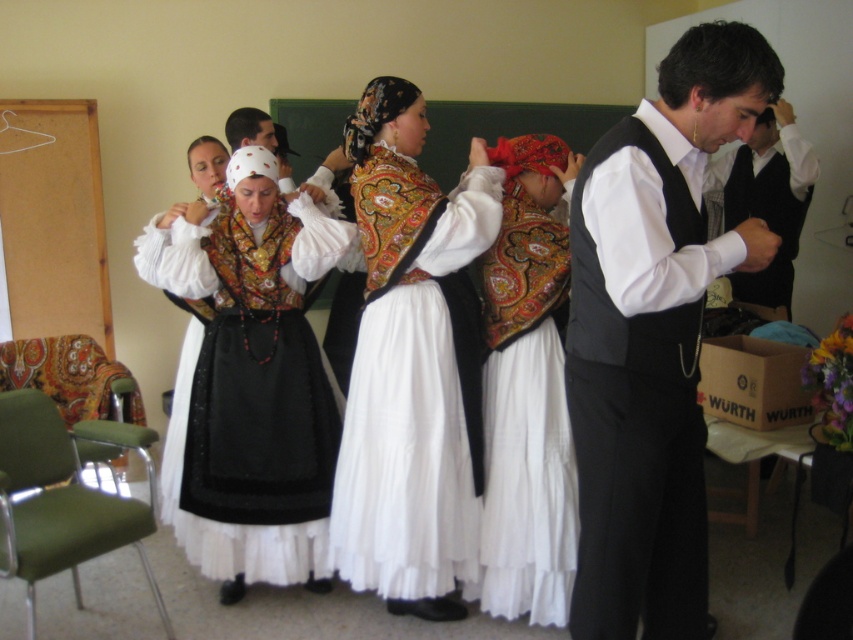
Does black satin vest at center have a lesser width compared to velvet-patterned armchair at left?

Yes, black satin vest at center is thinner than velvet-patterned armchair at left.

Measure the distance from black satin vest at center to velvet-patterned armchair at left.

6.68 feet

I want to click on black satin vest at center, so click(x=653, y=333).

Which is more to the right, black satin vest at center or matte black dress at center?

black satin vest at center is more to the right.

Is black satin vest at center above matte black dress at center?

Yes, black satin vest at center is above matte black dress at center.

Measure the distance between point [631,152] and camera.

A distance of 1.82 meters exists between point [631,152] and camera.

What are the coordinates of `black satin vest at center` in the screenshot? It's located at (653, 333).

Does embroidered silk blouse at center come behind velvet-patterned armchair at left?

No, it is in front of velvet-patterned armchair at left.

Which is below, embroidered silk blouse at center or velvet-patterned armchair at left?

velvet-patterned armchair at left

Is point (463, 356) more distant than point (106, 369)?

No.

At what (x,y) coordinates should I click in order to perform the action: click on embroidered silk blouse at center. Please return your answer as a coordinate pair (x, y). This screenshot has width=853, height=640. Looking at the image, I should click on (412, 364).